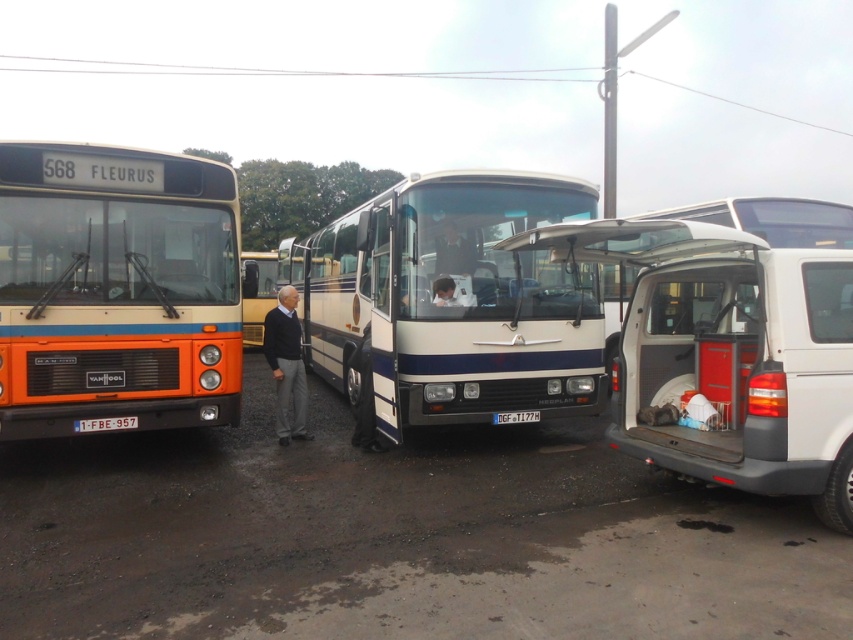
Which is below, smooth skin face at center or black plastic license plate at center?

black plastic license plate at center

Can you confirm if smooth skin face at center is positioned to the left of black plastic license plate at center?

Yes, smooth skin face at center is to the left of black plastic license plate at center.

Where is `smooth skin face at center`? smooth skin face at center is located at coordinates (444, 291).

Does point (473, 244) lie behind point (129, 417)?

Yes, point (473, 244) is behind point (129, 417).

Identify the location of white glossy bus at center. (457, 298).

Can you confirm if gray wool sweater at center is thinner than white plastic license plate at center?

Incorrect, gray wool sweater at center's width is not less than white plastic license plate at center's.

Between point (292, 365) and point (114, 417), which one is positioned behind?

The point (292, 365) is behind.

Is point (288, 321) closer to viewer compared to point (97, 426)?

No, (288, 321) is behind (97, 426).

Locate an element on the screen. The image size is (853, 640). gray wool sweater at center is located at coordinates (286, 364).